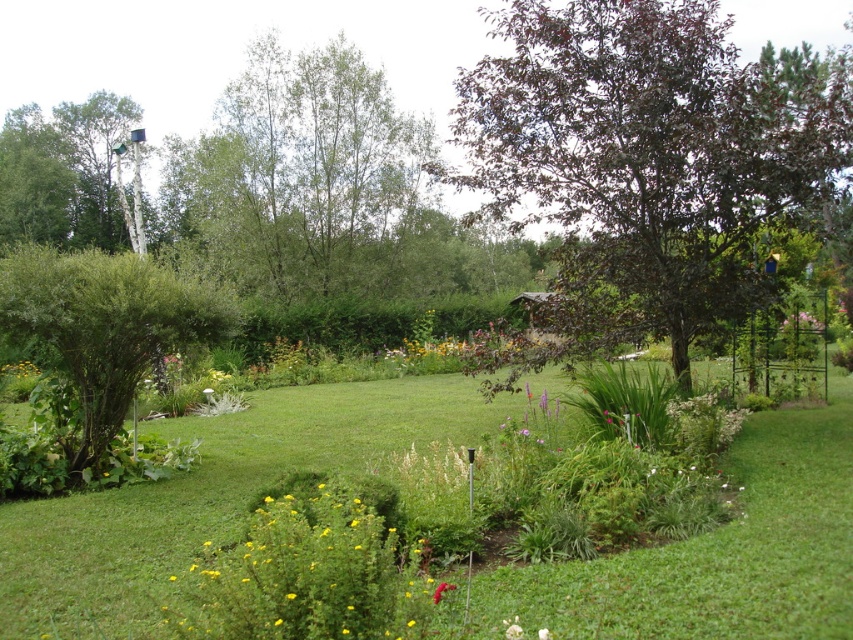
Question: Based on their relative distances, which object is nearer to the green leafy tree at upper center?

Choices:
 (A) yellow matte flower at center
 (B) green grass at center
 (C) pink matte flower at upper right

Answer: (B)

Question: Which of the following is the closest to the observer?

Choices:
 (A) click(119, 364)
 (B) click(608, 257)

Answer: (A)

Question: Does green leafy tree at upper center have a larger size compared to yellow matte flower at lower center?

Choices:
 (A) yes
 (B) no

Answer: (A)

Question: Considering the relative positions of green leafy tree at upper center and bright yellow flower at center in the image provided, where is green leafy tree at upper center located with respect to bright yellow flower at center?

Choices:
 (A) left
 (B) right

Answer: (A)

Question: Which is farther from the green leafy bush at left?

Choices:
 (A) yellow-green foliage at center
 (B) bright yellow flower at center

Answer: (B)

Question: Is purple glossy tree at upper right above white smooth tree at upper left?

Choices:
 (A) no
 (B) yes

Answer: (A)